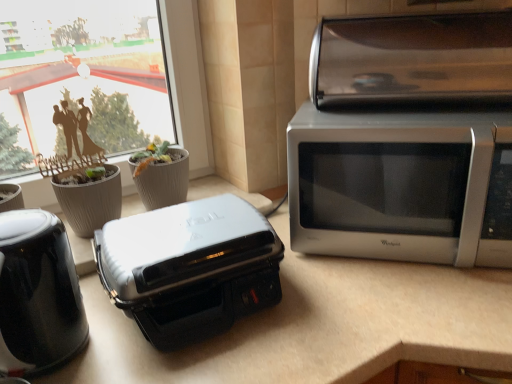
Locate an element on the screen. Image resolution: width=512 pixels, height=384 pixels. vacant point to the right of white plastic toaster at center is located at coordinates (326, 315).